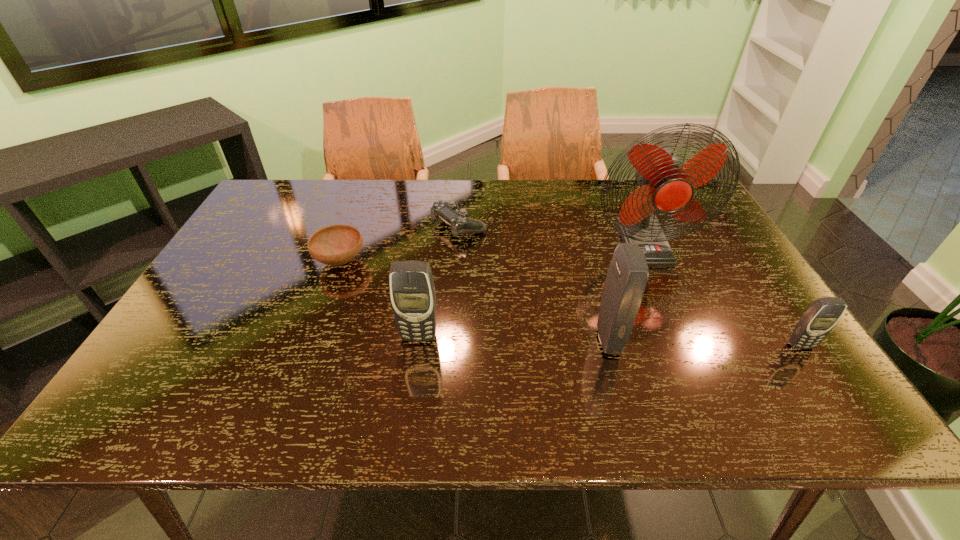
Find the location of `free point that keeps the cellular telephones evenly spaced on the left`. free point that keeps the cellular telephones evenly spaced on the left is located at coordinates (233, 333).